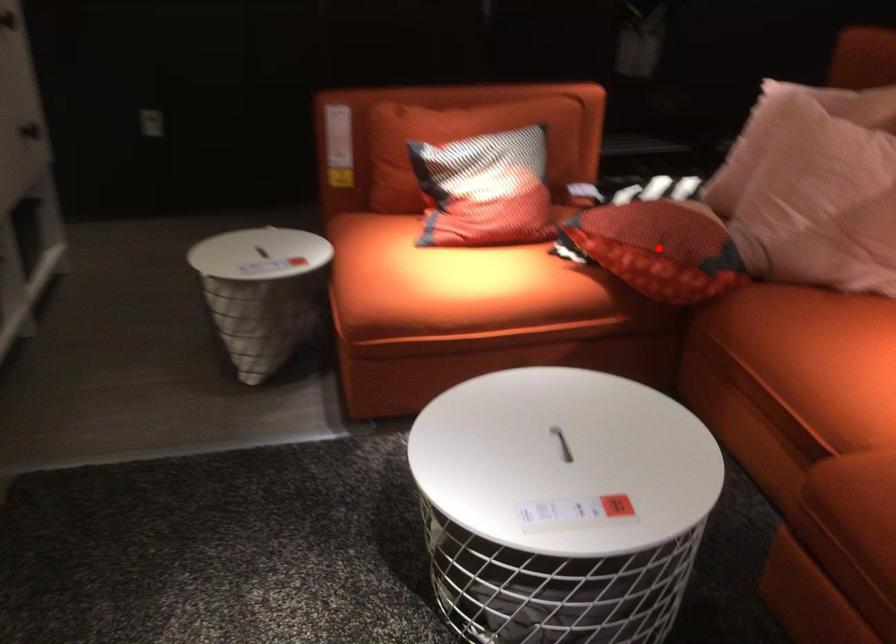
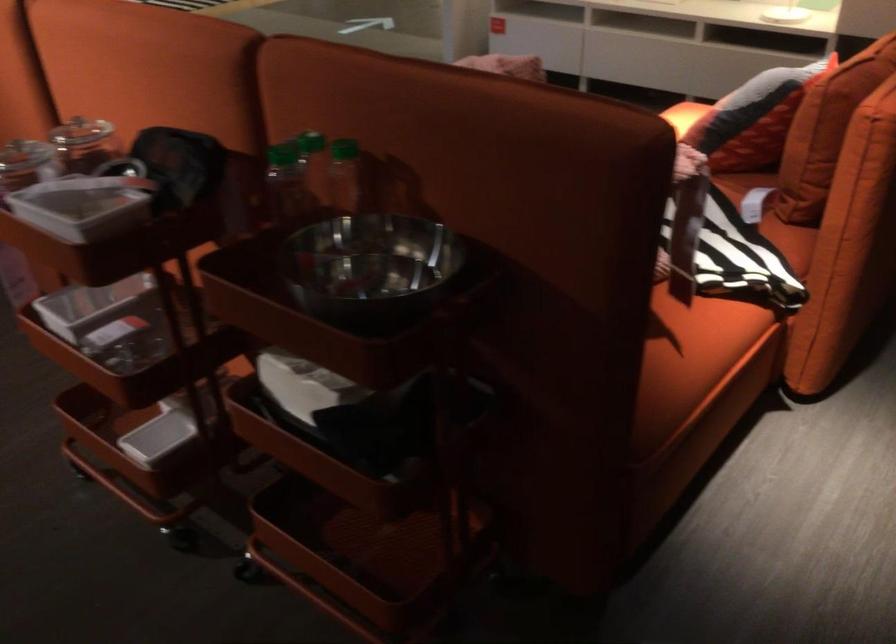
Question: I am providing you with two images of the same scene from different viewpoints. A red point is marked on the first image. At the location where the point appears in image 1, is it still visible in image 2?

Choices:
 (A) Yes
 (B) No

Answer: (B)